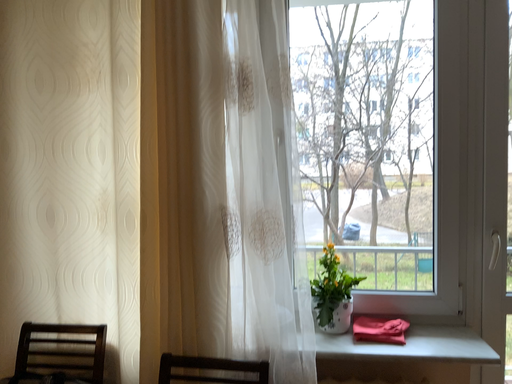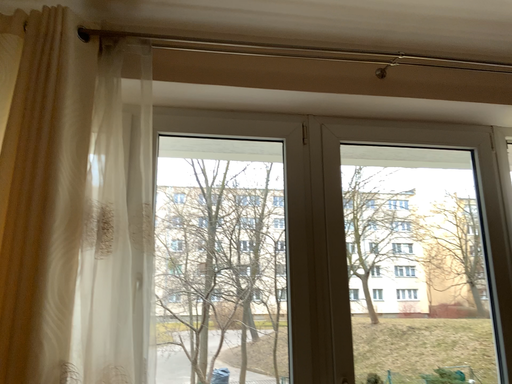
Question: Which way did the camera rotate in the video?

Choices:
 (A) rotated downward
 (B) rotated upward

Answer: (B)